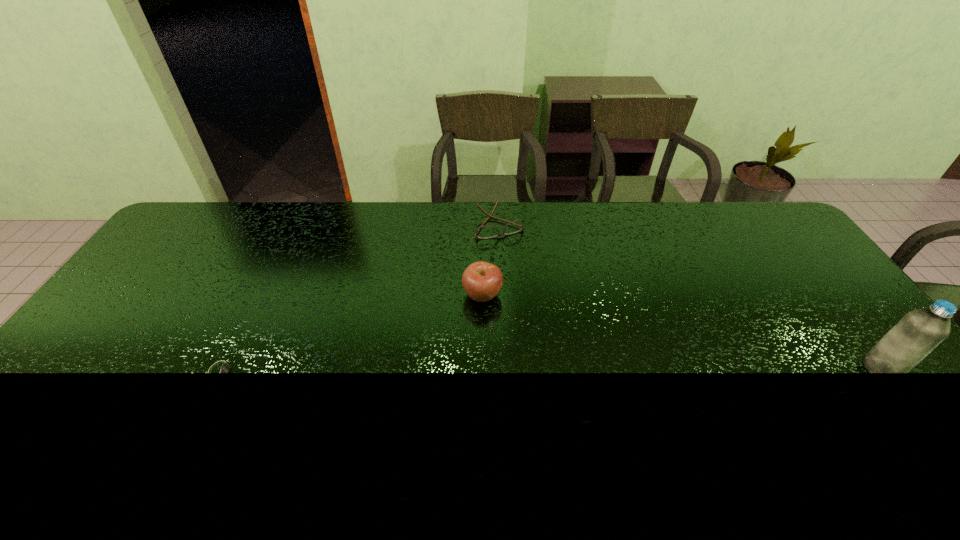
At what (x,y) coordinates should I click in order to perform the action: click on watch. Please return your answer as a coordinate pair (x, y). The height and width of the screenshot is (540, 960). Looking at the image, I should click on (226, 362).

Identify the location of the shortest object. The image size is (960, 540). (226, 362).

Identify the location of the rightmost object. This screenshot has width=960, height=540. (920, 331).

The height and width of the screenshot is (540, 960). In order to click on water bottle in this screenshot , I will do `click(920, 331)`.

You are a GUI agent. You are given a task and a screenshot of the screen. Output one action in this format:
    pyautogui.click(x=<x>, y=<y>)
    Task: Click on the third shortest object
    The width and height of the screenshot is (960, 540).
    Given the screenshot: What is the action you would take?
    pyautogui.click(x=482, y=281)

Locate an element on the screen. The width and height of the screenshot is (960, 540). the third nearest object is located at coordinates (482, 281).

This screenshot has width=960, height=540. In order to click on spectacles in this screenshot , I will do `click(483, 232)`.

At what (x,y) coordinates should I click in order to perform the action: click on the third tallest object. Please return your answer as a coordinate pair (x, y). The width and height of the screenshot is (960, 540). Looking at the image, I should click on (483, 232).

The width and height of the screenshot is (960, 540). I want to click on vacant point located on the face of the shortest object, so click(x=341, y=372).

This screenshot has height=540, width=960. Identify the location of blank space located 0.120m on the left of the water bottle. (818, 368).